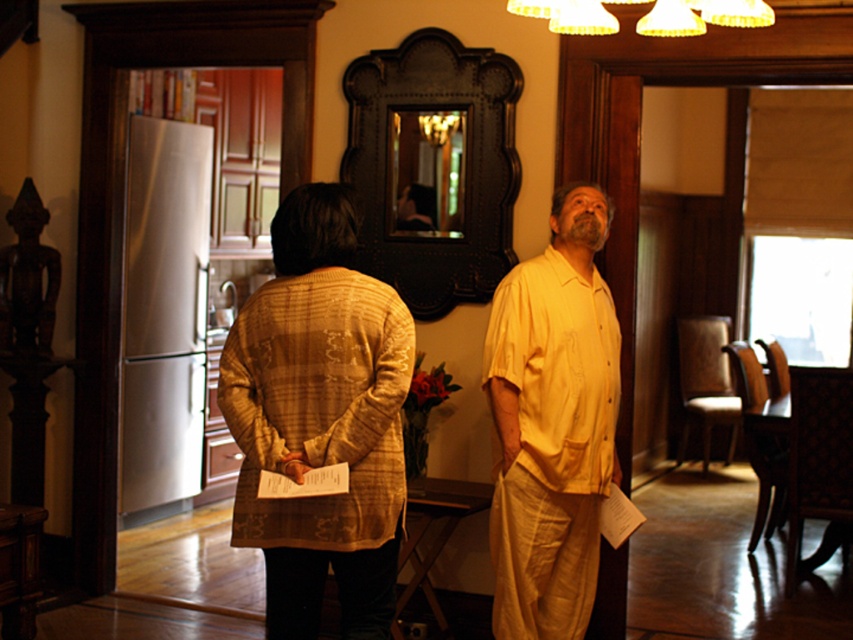
Is point (378, 513) closer to camera compared to point (576, 492)?

Yes, point (378, 513) is closer to viewer.

Can you confirm if matte yellow shirt at center is positioned above yellow cotton shirt at center?

Correct, matte yellow shirt at center is located above yellow cotton shirt at center.

Between point (254, 436) and point (575, 316), which one is positioned behind?

Positioned behind is point (575, 316).

The width and height of the screenshot is (853, 640). What are the coordinates of `matte yellow shirt at center` in the screenshot? It's located at (320, 419).

Is the position of matte yellow shirt at center less distant than that of matte yellow cardigan at center?

Yes, matte yellow shirt at center is closer to the viewer.

Is point (556, 232) farther from camera compared to point (297, 572)?

Yes, point (556, 232) is behind point (297, 572).

Where is `matte yellow shirt at center`? Image resolution: width=853 pixels, height=640 pixels. matte yellow shirt at center is located at coordinates (320, 419).

Is matte yellow cardigan at center thinner than yellow cotton shirt at center?

No.

Find the location of `matte yellow cardigan at center`. matte yellow cardigan at center is located at coordinates (320, 419).